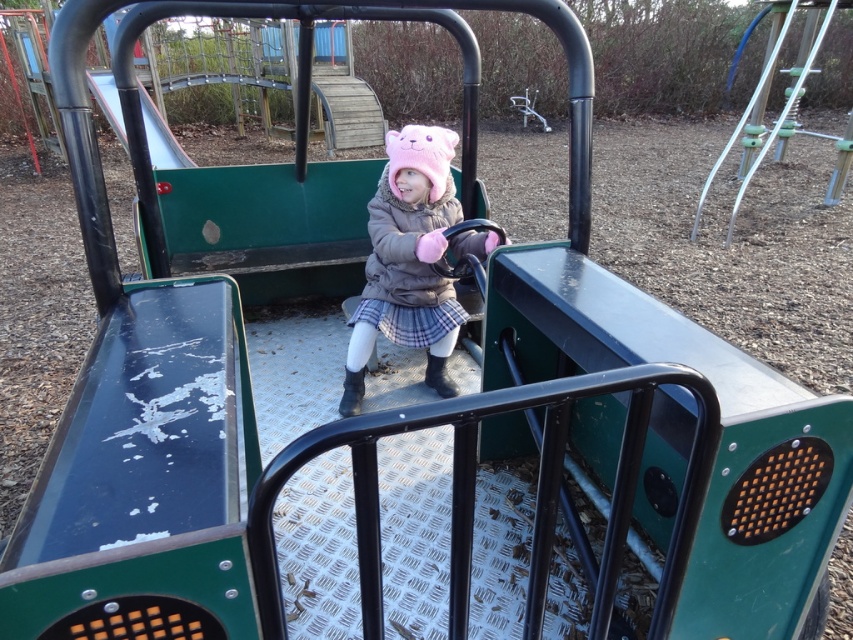
Question: Is pink fuzzy hat at center above smooth metal slide at upper left?

Choices:
 (A) no
 (B) yes

Answer: (A)

Question: Is pink fuzzy hat at center behind smooth metal slide at upper left?

Choices:
 (A) no
 (B) yes

Answer: (A)

Question: Which point is closer to the camera?

Choices:
 (A) (120, 125)
 (B) (407, 300)

Answer: (B)

Question: Does pink fuzzy hat at center appear on the left side of smooth metal slide at upper left?

Choices:
 (A) yes
 (B) no

Answer: (B)

Question: Which of the following is the farthest from the observer?

Choices:
 (A) smooth metal slide at upper left
 (B) pink fuzzy hat at center

Answer: (A)